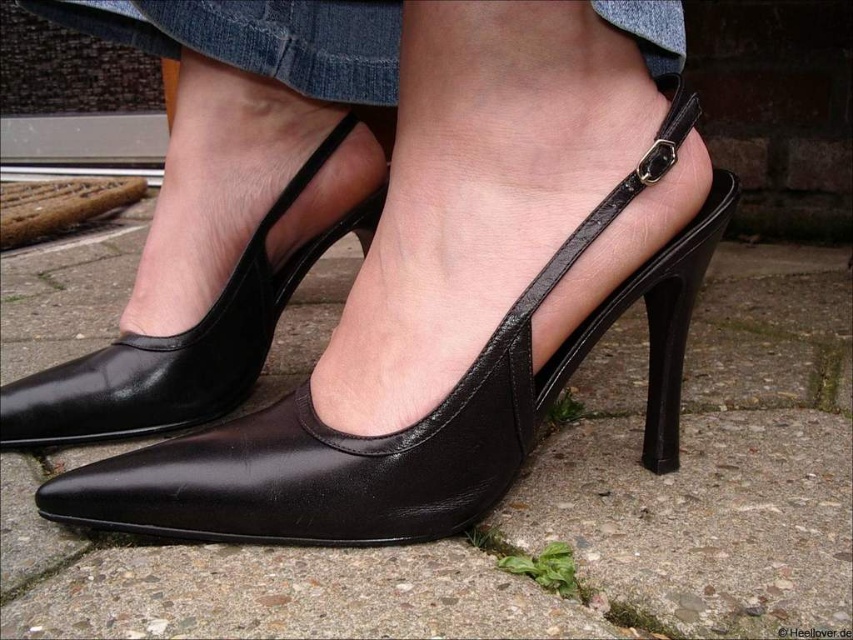
Question: Does black leather sandal at center have a greater width compared to black leather shoe at center?

Choices:
 (A) yes
 (B) no

Answer: (A)

Question: Is black leather sandal at center to the right of black leather shoe at center from the viewer's perspective?

Choices:
 (A) no
 (B) yes

Answer: (B)

Question: Which object is closer to the camera taking this photo?

Choices:
 (A) black leather shoe at center
 (B) black leather sandal at center

Answer: (B)

Question: Can you confirm if black leather sandal at center is wider than black leather shoe at center?

Choices:
 (A) no
 (B) yes

Answer: (B)

Question: Which object appears farthest from the camera in this image?

Choices:
 (A) black leather shoe at center
 (B) black leather sandal at center

Answer: (A)